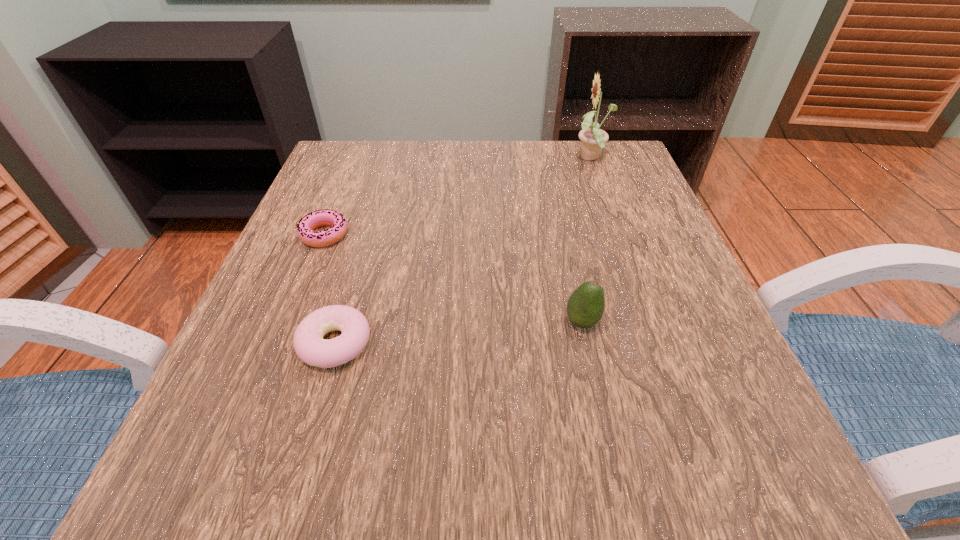
In the image, there is a desktop. Where is `vacant area at the right edge`? The height and width of the screenshot is (540, 960). vacant area at the right edge is located at coordinates (745, 430).

Locate an element on the screen. This screenshot has width=960, height=540. vacant space at the far left corner of the desktop is located at coordinates (384, 153).

You are a GUI agent. You are given a task and a screenshot of the screen. Output one action in this format:
    pyautogui.click(x=<x>, y=<y>)
    Task: Click on the free space at the near right corner
    This screenshot has height=540, width=960.
    Given the screenshot: What is the action you would take?
    pyautogui.click(x=655, y=442)

The width and height of the screenshot is (960, 540). In order to click on free space between the second object from right to left and the taller doughnut in this screenshot , I will do `click(459, 333)`.

Locate an element on the screen. unoccupied area between the tallest object and the avocado is located at coordinates (587, 240).

The height and width of the screenshot is (540, 960). I want to click on vacant point located between the farther doughnut and the tallest object, so click(x=458, y=197).

Locate an element on the screen. Image resolution: width=960 pixels, height=540 pixels. vacant area that lies between the farthest object and the third object from left to right is located at coordinates (587, 240).

Identify the location of empty space that is in between the farther doughnut and the tallest object. (458, 197).

Where is `free space between the shorter doughnut and the second shortest object`? free space between the shorter doughnut and the second shortest object is located at coordinates (330, 289).

Find the location of a particular element. The width and height of the screenshot is (960, 540). free space between the second object from right to left and the nearer doughnut is located at coordinates (459, 333).